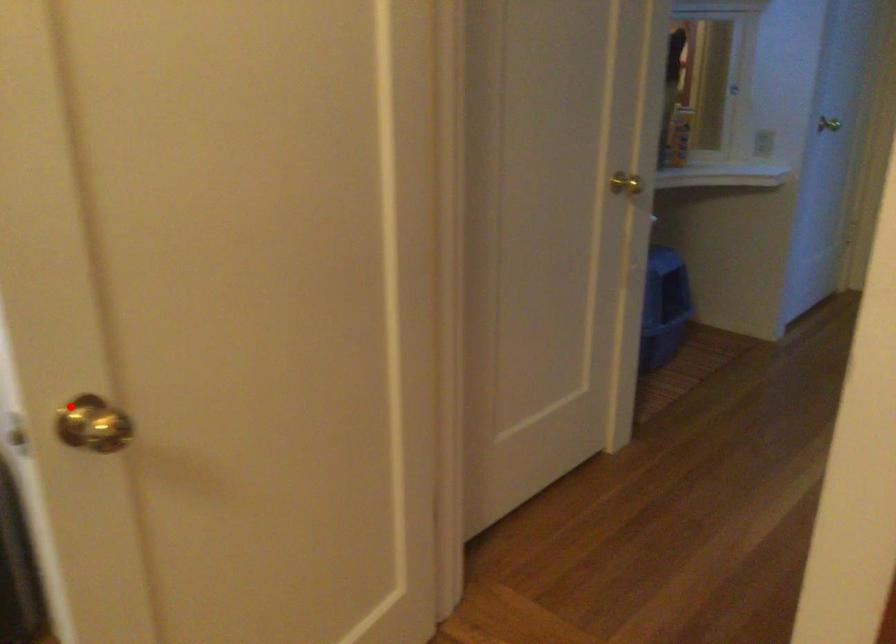
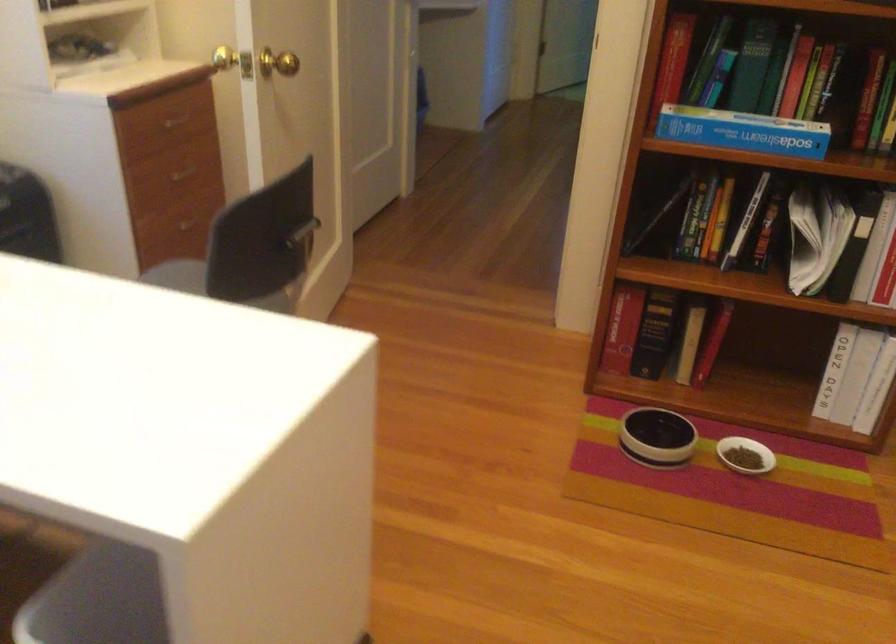
Question: I am providing you with two images of the same scene from different viewpoints. Given a red point in image1, look at the same physical point in image2. Is it:

Choices:
 (A) Closer to the viewpoint
 (B) Farther from the viewpoint

Answer: (B)